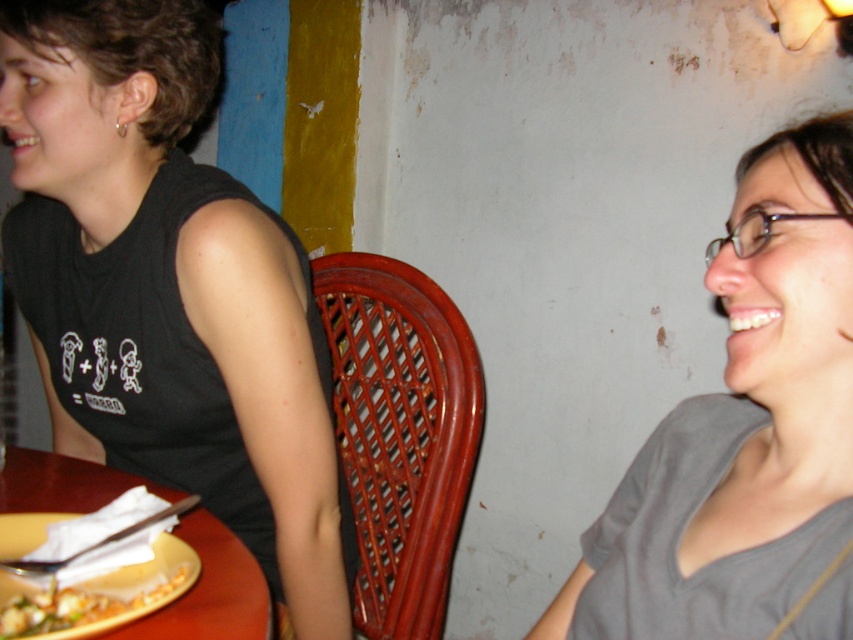
Between black matte tank top at left and gray matte shirt at upper right, which one appears on the left side from the viewer's perspective?

From the viewer's perspective, black matte tank top at left appears more on the left side.

Is black matte tank top at left thinner than gray matte shirt at upper right?

Incorrect, black matte tank top at left's width is not less than gray matte shirt at upper right's.

At what (x,y) coordinates should I click in order to perform the action: click on black matte tank top at left. Please return your answer as a coordinate pair (x, y). Image resolution: width=853 pixels, height=640 pixels. Looking at the image, I should click on (169, 289).

Where is `black matte tank top at left`? This screenshot has height=640, width=853. black matte tank top at left is located at coordinates (169, 289).

Is wooden table at lower left to the right of yellow matte plate at lower left from the viewer's perspective?

In fact, wooden table at lower left is to the left of yellow matte plate at lower left.

Which is more to the right, wooden table at lower left or yellow matte plate at lower left?

yellow matte plate at lower left is more to the right.

Find the location of a particular element. The width and height of the screenshot is (853, 640). wooden table at lower left is located at coordinates (209, 592).

This screenshot has width=853, height=640. Identify the location of wooden table at lower left. (209, 592).

Does gray matte shirt at upper right appear on the right side of yellow matte plate at lower left?

Yes, gray matte shirt at upper right is to the right of yellow matte plate at lower left.

Between point (808, 449) and point (42, 528), which one is positioned in front?

Point (808, 449)

The width and height of the screenshot is (853, 640). What are the coordinates of `gray matte shirt at upper right` in the screenshot? It's located at (746, 435).